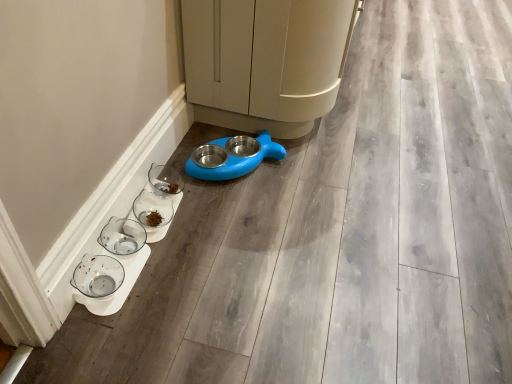
Find the location of a particular element. This screenshot has height=384, width=512. vacant space to the right of blue plastic pet feeder at center is located at coordinates (301, 168).